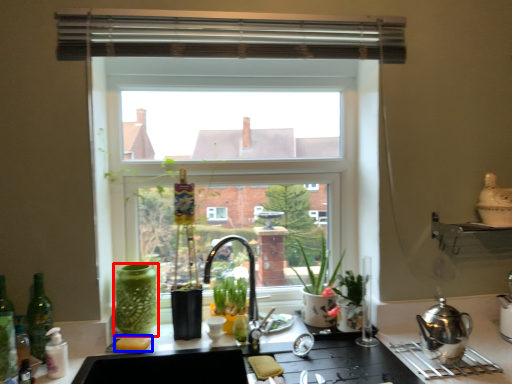
Question: Which point is closer to the camera, glass vase (highlighted by a red box) or food (highlighted by a blue box)?

Choices:
 (A) glass vase
 (B) food

Answer: (B)